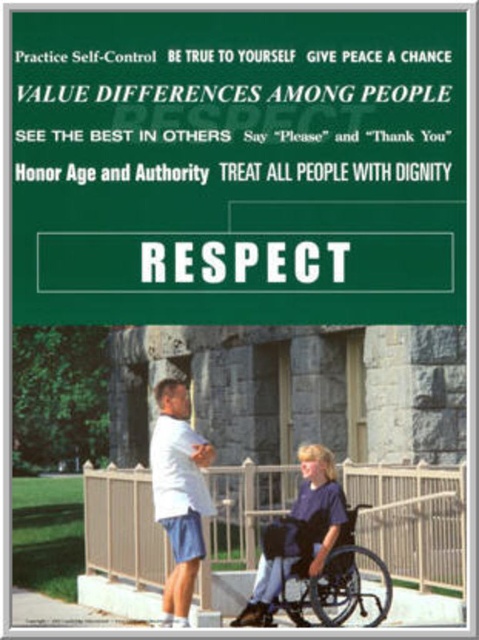
Can you confirm if blue fabric wheelchair at lower center is bigger than black plastic wheelchair at lower center?

Yes, blue fabric wheelchair at lower center is bigger than black plastic wheelchair at lower center.

Between blue fabric wheelchair at lower center and black plastic wheelchair at lower center, which one has more height?

Standing taller between the two is blue fabric wheelchair at lower center.

Does point (300, 566) lie in front of point (322, 589)?

No, it is behind (322, 589).

Where is `blue fabric wheelchair at lower center`? The image size is (479, 640). blue fabric wheelchair at lower center is located at coordinates (297, 534).

Does green paper sign at center appear on the right side of black plastic wheelchair at lower center?

Incorrect, green paper sign at center is not on the right side of black plastic wheelchair at lower center.

Where is `green paper sign at center`? The height and width of the screenshot is (640, 479). green paper sign at center is located at coordinates (239, 166).

Who is more distant from viewer, (x=151, y=232) or (x=350, y=596)?

The point (x=151, y=232) is more distant.

Locate an element on the screen. Image resolution: width=479 pixels, height=640 pixels. green paper sign at center is located at coordinates (239, 166).

Can you confirm if white matte shirt at center is positioned below black plastic wheelchair at lower center?

No, white matte shirt at center is not below black plastic wheelchair at lower center.

In the scene shown: Who is shorter, white matte shirt at center or black plastic wheelchair at lower center?

With less height is black plastic wheelchair at lower center.

Does point (185, 605) lie behind point (363, 602)?

That is False.

Locate an element on the screen. This screenshot has height=640, width=479. white matte shirt at center is located at coordinates (179, 493).